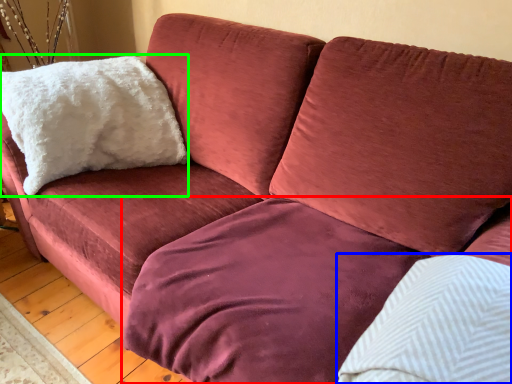
Question: Which object is the farthest from bedding (highlighted by a red box)? Choose among these: pillow (highlighted by a blue box) or pillow (highlighted by a green box).

Choices:
 (A) pillow
 (B) pillow

Answer: (B)